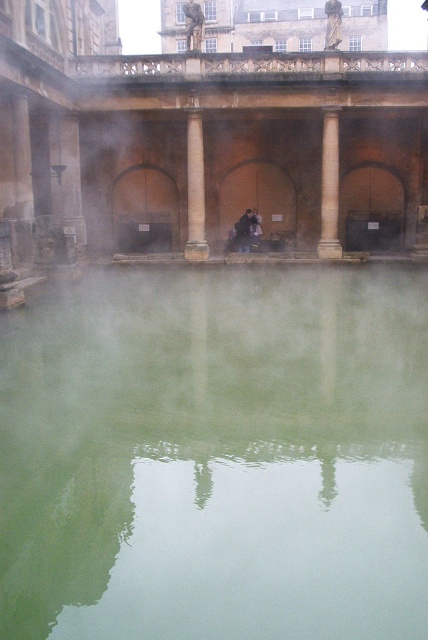
You are standing at the point marked by coordinates (216,456) in the Roman bathhouse scene. Describe what you see directly below you based on the provided scene description.

The point marked by coordinates (216,456) is directly above the green reflective water at center, so you would see the green reflective water below you.

You are standing at the edge of the pool in the Roman Baths and notice two points marked on the water surface. The first point is at coordinate point (333, 186) and the second is at point (243, 216). Which point is closer to you as you face the pool?

Point (333, 186) is in front of point (243, 216), so the first point is closer to you.

You are a tourist visiting the Roman Baths and notice a smooth stone column at center and a dark brown leather jacket at center. Which object is smaller in size?

The smooth stone column at center is smaller than the dark brown leather jacket at center.